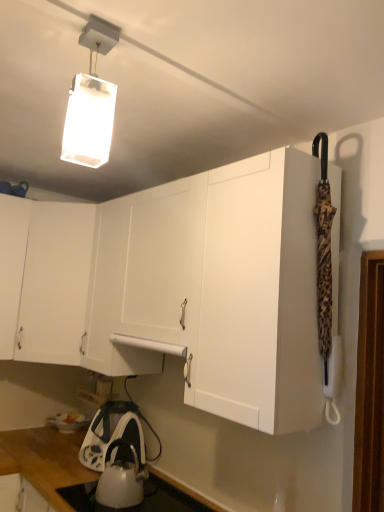
Measure the distance between white matte cabinet at upper left and camera.

white matte cabinet at upper left and camera are 7.64 feet apart from each other.

Locate an element on the screen. white matte rectangular light fixture at upper center is located at coordinates (90, 105).

Is white matte cabinet at upper left aimed at white glossy kettle at lower center?

No.

Is white matte cabinet at upper left shorter than white glossy kettle at lower center?

No.

From a real-world perspective, which is physically above, white matte cabinet at upper left or white glossy kettle at lower center?

In real-world perspective, white matte cabinet at upper left is above.

How much distance is there between white glossy kettle at lower center and white matte cabinet at upper left?

white glossy kettle at lower center is 34.24 inches from white matte cabinet at upper left.

From the image's perspective, which object appears higher, white glossy kettle at lower center or white matte cabinet at upper left?

white matte cabinet at upper left appears higher in the image.

Is white glossy kettle at lower center thinner than white matte cabinet at upper left?

Yes.

Can you tell me how much white glossy kettle at lower center and white matte cabinet at upper left differ in facing direction?

46.4 degrees separate the facing orientations of white glossy kettle at lower center and white matte cabinet at upper left.

Locate an element on the screen. This screenshot has width=384, height=512. kettle that appears above the white glossy kettle at lower center (from the image's perspective) is located at coordinates (121, 479).

Between point (132, 451) and point (137, 438), which one is positioned behind?

Positioned behind is point (137, 438).

Can you tell me how much white glossy kettle at lower center and white glossy kettle at lower center differ in facing direction?

3.49 degrees.

From the image's perspective, would you say white glossy kettle at lower center is shown under white glossy kettle at lower center?

No, from the image's perspective, white glossy kettle at lower center is not beneath white glossy kettle at lower center.

In the scene shown: What's the angular difference between white glossy kettle at lower center and white glossy kettle at lower center's facing directions?

3.49 degrees separate the facing orientations of white glossy kettle at lower center and white glossy kettle at lower center.

From a real-world perspective, is white glossy kettle at lower center physically above white glossy kettle at lower center?

Yes, from a real-world perspective, white glossy kettle at lower center is above white glossy kettle at lower center.

From the image's perspective, is white glossy kettle at lower center on white glossy kettle at lower center?

No.

In order to click on appliance lying on the left of white glossy kettle at lower center in this screenshot , I will do `click(112, 433)`.

Relative to white glossy kettle at lower center, is white matte cabinet at upper left in front or behind?

Clearly, white matte cabinet at upper left is behind white glossy kettle at lower center.

From a real-world perspective, between white matte cabinet at upper left and white glossy kettle at lower center, who is vertically lower?

white glossy kettle at lower center.

How different are the orientations of white matte cabinet at upper left and white glossy kettle at lower center in degrees?

They differ by 46.4 degrees in their facing directions.

Is white matte cabinet at upper left beside white glossy kettle at lower center?

white matte cabinet at upper left and white glossy kettle at lower center are not in contact.

From the image's perspective, is white glossy kettle at lower center above white matte cabinet at upper left?

No.

Between white glossy kettle at lower center and white matte cabinet at upper left, which one has smaller width?

Thinner between the two is white glossy kettle at lower center.

Is white matte cabinet at upper left surrounded by white glossy kettle at lower center?

No, white glossy kettle at lower center does not contain white matte cabinet at upper left.

Considering the positions of objects white glossy kettle at lower center and white matte cabinet at upper left in the image provided, who is in front, white glossy kettle at lower center or white matte cabinet at upper left?

white glossy kettle at lower center.

Does white matte rectangular light fixture at upper center turn towards white glossy kettle at lower center?

No, white matte rectangular light fixture at upper center is not aimed at white glossy kettle at lower center.

What's the angular difference between white matte rectangular light fixture at upper center and white glossy kettle at lower center's facing directions?

The angular difference between white matte rectangular light fixture at upper center and white glossy kettle at lower center is 86.1 degrees.

You are a GUI agent. You are given a task and a screenshot of the screen. Output one action in this format:
    pyautogui.click(x=<x>, y=<y>)
    Task: Click on the appliance below the white matte rectangular light fixture at upper center (from the image's perspective)
    The image size is (384, 512).
    Given the screenshot: What is the action you would take?
    pyautogui.click(x=112, y=433)

You are a GUI agent. You are given a task and a screenshot of the screen. Output one action in this format:
    pyautogui.click(x=<x>, y=<y>)
    Task: Click on the cabinetry that appears above the white glossy kettle at lower center (from a real-world perspective)
    The width and height of the screenshot is (384, 512).
    Given the screenshot: What is the action you would take?
    pyautogui.click(x=55, y=282)

Where is `kettle on the right of the white matte cabinet at upper left`? kettle on the right of the white matte cabinet at upper left is located at coordinates (121, 479).

Which object lies further to the anchor point white matte rectangular light fixture at upper center, white glossy kettle at lower center or white matte cabinet at upper left?

Based on the image, white glossy kettle at lower center appears to be further to white matte rectangular light fixture at upper center.

Estimate the real-world distances between objects in this image. Which object is further from white matte rectangular light fixture at upper center, white glossy kettle at lower center or white matte cabinet at upper left?

Based on the image, white glossy kettle at lower center appears to be further to white matte rectangular light fixture at upper center.

When comparing their distances from white matte cabinet at upper left, does white matte rectangular light fixture at upper center or white glossy kettle at lower center seem closer?

The object closer to white matte cabinet at upper left is white glossy kettle at lower center.

When comparing their distances from white matte cabinet at upper left, does white matte rectangular light fixture at upper center or white glossy kettle at lower center seem closer?

The object closer to white matte cabinet at upper left is white glossy kettle at lower center.

Based on their spatial positions, is white glossy kettle at lower center or white matte cabinet at upper left closer to white glossy kettle at lower center?

white glossy kettle at lower center lies closer to white glossy kettle at lower center than the other object.

Based on their spatial positions, is white matte cabinet at upper left or white matte rectangular light fixture at upper center further from white glossy kettle at lower center?

white matte rectangular light fixture at upper center lies further to white glossy kettle at lower center than the other object.

From the image, which object appears to be nearer to white matte cabinet at upper left, white glossy kettle at lower center or white matte rectangular light fixture at upper center?

white glossy kettle at lower center.

Which object lies nearer to the anchor point white matte rectangular light fixture at upper center, white matte cabinet at upper left or white glossy kettle at lower center?

white matte cabinet at upper left lies closer to white matte rectangular light fixture at upper center than the other object.

The width and height of the screenshot is (384, 512). Identify the location of kettle between white matte cabinet at upper left and white glossy kettle at lower center in the up-down direction. (121, 479).

Where is `cabinetry between white matte rectangular light fixture at upper center and white glossy kettle at lower center in the up-down direction`? Image resolution: width=384 pixels, height=512 pixels. cabinetry between white matte rectangular light fixture at upper center and white glossy kettle at lower center in the up-down direction is located at coordinates (55, 282).

Identify the location of cabinetry that lies between white matte rectangular light fixture at upper center and white glossy kettle at lower center from top to bottom. (55, 282).

Locate an element on the screen. The height and width of the screenshot is (512, 384). kettle between white matte rectangular light fixture at upper center and white glossy kettle at lower center vertically is located at coordinates (121, 479).